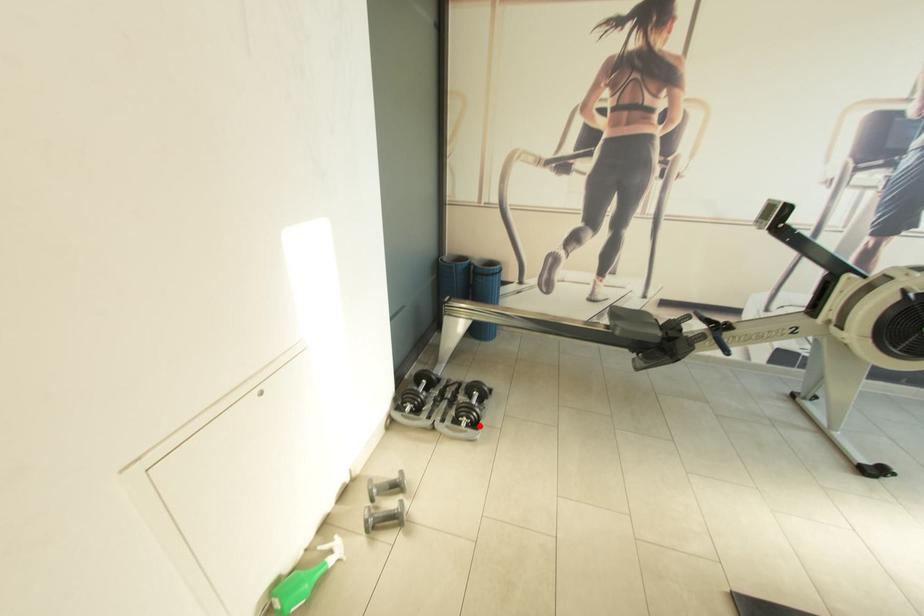
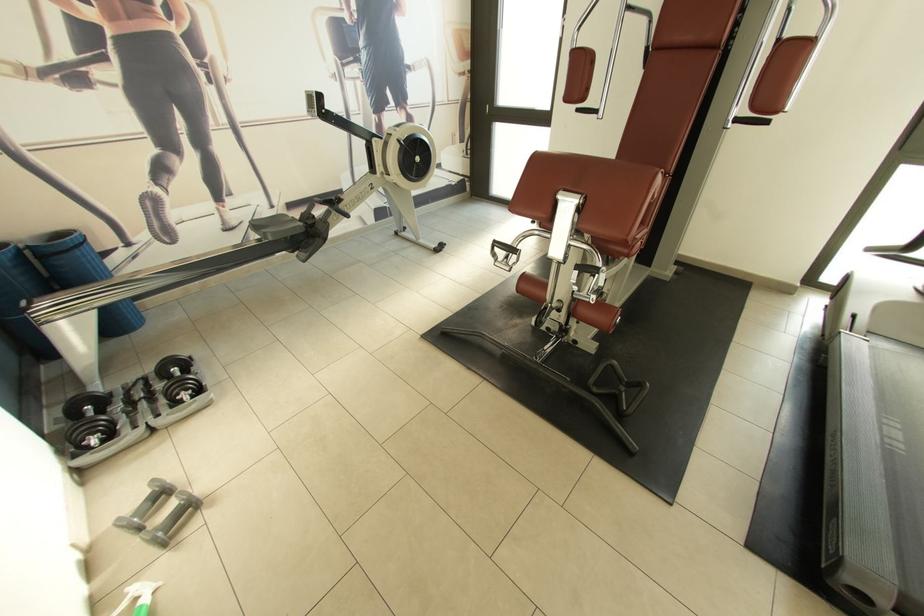
The point at the highlighted location is marked in the first image. Where is the corresponding point in the second image?

(204, 392)